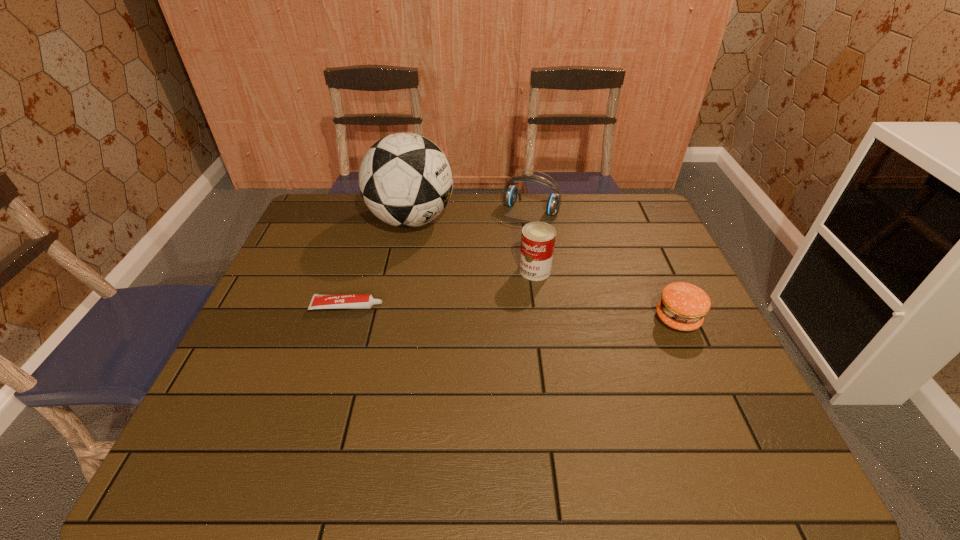
In order to click on free space on the desktop that is between the toothpaste and the fourth tallest object and is positioned on the surface of the soccer ball where the brand logo is visible in this screenshot , I will do 497,312.

Where is `vacant spot on the desktop that is between the shortest object and the patty and is positioned on the ear cups of the headset`? The height and width of the screenshot is (540, 960). vacant spot on the desktop that is between the shortest object and the patty and is positioned on the ear cups of the headset is located at coordinates (474, 311).

Locate an element on the screen. The width and height of the screenshot is (960, 540). vacant space on the desktop that is between the shortest object and the rightmost object and is positioned on the front label of the can is located at coordinates pyautogui.click(x=477, y=311).